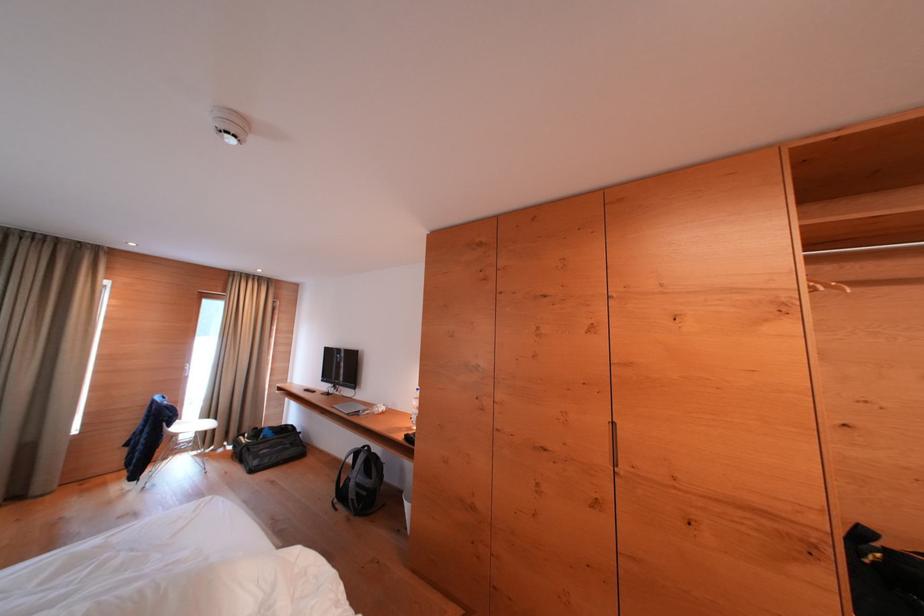
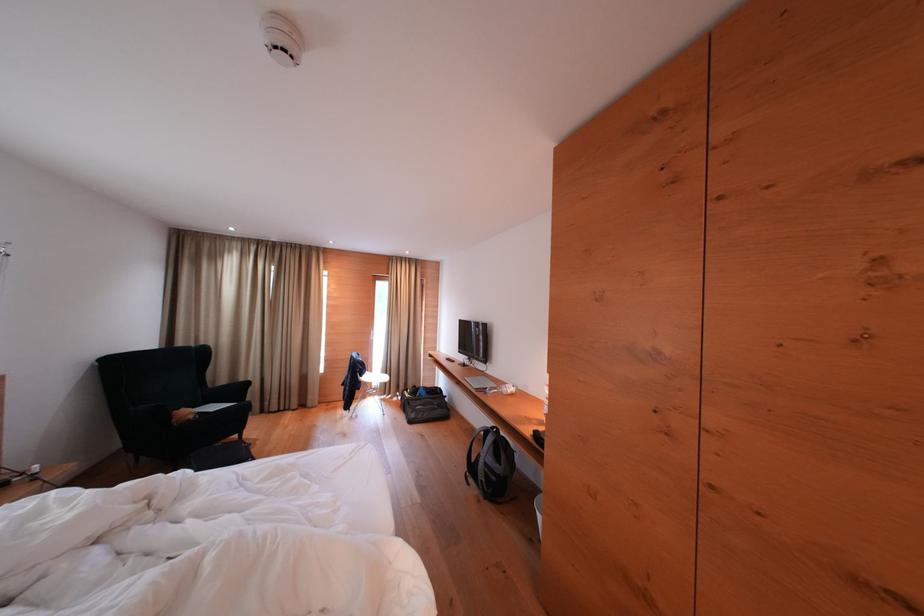
Where in the second image is the point corresponding to [199,429] from the first image?

(383, 379)